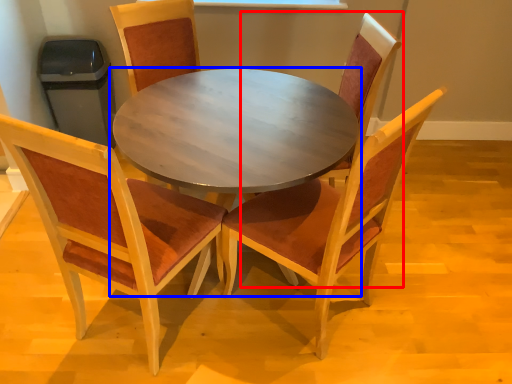
Question: Among these objects, which one is farthest to the camera, chair (highlighted by a red box) or coffee table (highlighted by a blue box)?

Choices:
 (A) chair
 (B) coffee table

Answer: (A)